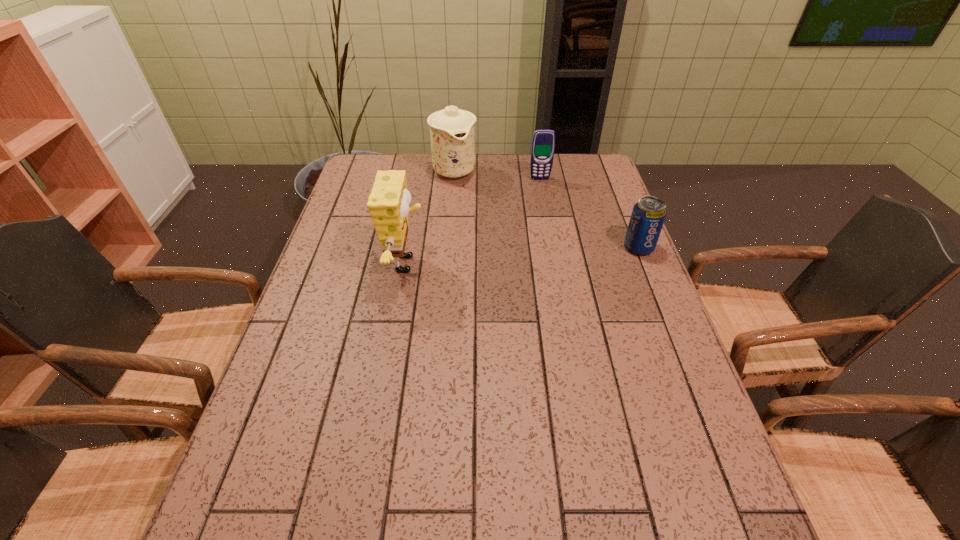
Identify the location of free space on the desktop that is between the sponge and the rightmost object and is positioned on the front-facing side of the cellular telephone. This screenshot has height=540, width=960. (553, 254).

Identify the location of free space on the desktop that is between the sponge and the rightmost object and is positioned on the spout of the chinaware. (511, 256).